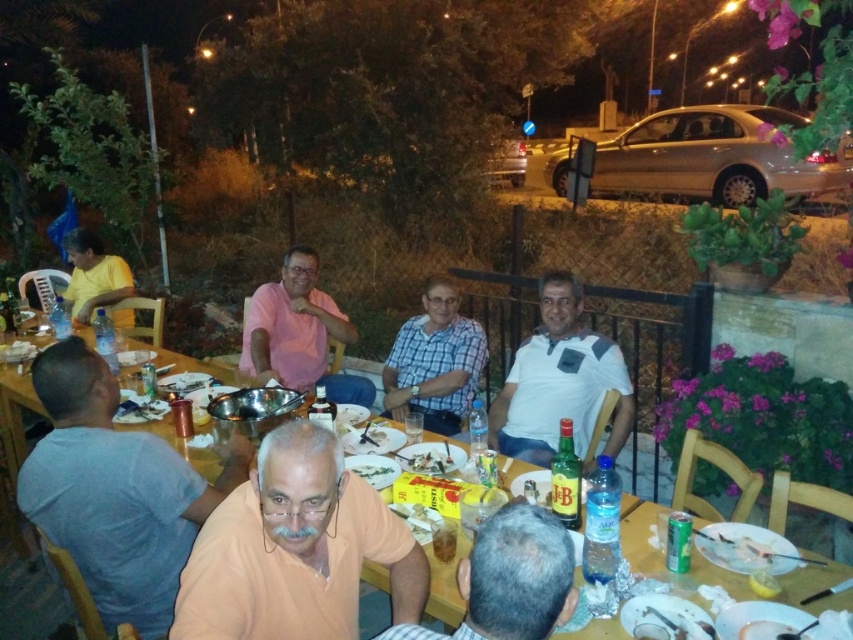
Does orange matte shirt at center appear under blue cotton shirt at left?

Yes, orange matte shirt at center is below blue cotton shirt at left.

Does orange matte shirt at center appear over blue cotton shirt at left?

Incorrect, orange matte shirt at center is not positioned above blue cotton shirt at left.

Where is `orange matte shirt at center`? The width and height of the screenshot is (853, 640). orange matte shirt at center is located at coordinates (294, 548).

Where is `orange matte shirt at center`? orange matte shirt at center is located at coordinates pos(294,548).

Describe the element at coordinates (115, 492) in the screenshot. Image resolution: width=853 pixels, height=640 pixels. I see `blue cotton shirt at left` at that location.

Who is more distant from viewer, (x=55, y=412) or (x=413, y=460)?

Positioned behind is point (x=413, y=460).

Where is `blue cotton shirt at left`? The height and width of the screenshot is (640, 853). blue cotton shirt at left is located at coordinates click(x=115, y=492).

Between point (399, 628) and point (117, 282), which one is positioned in front?

Point (399, 628) is more forward.

Does light brown leather chair at lower center appear over matte yellow shirt at left?

No.

Is point (527, 609) behind point (96, 253)?

That is False.

I want to click on light brown leather chair at lower center, so [x=509, y=579].